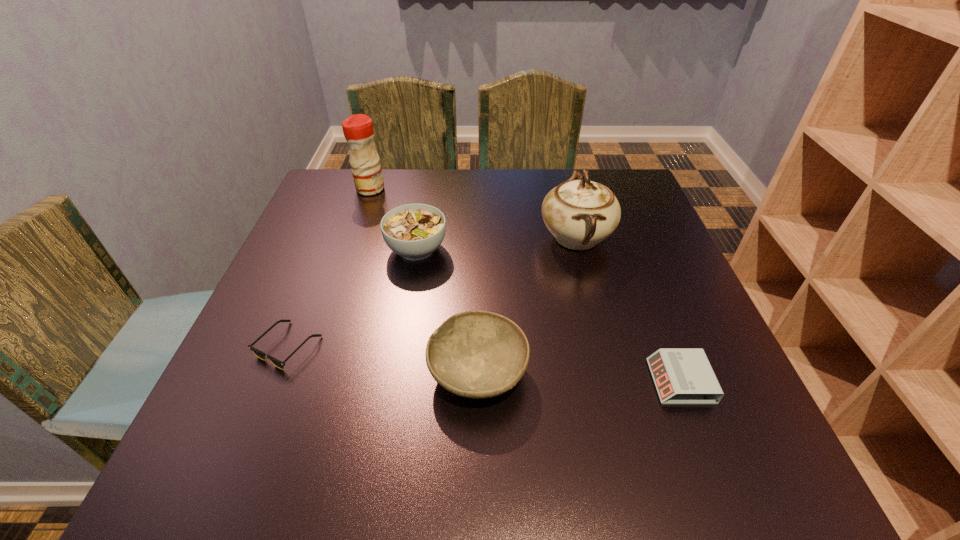
Find the location of `free location located on the back of the fifth tallest object`. free location located on the back of the fifth tallest object is located at coordinates (621, 230).

Locate an element on the screen. Image resolution: width=960 pixels, height=540 pixels. free space located on the lenses of the shortest object is located at coordinates (267, 398).

At what (x,y) coordinates should I click in order to perform the action: click on condiment present at the far edge. Please return your answer as a coordinate pair (x, y). Looking at the image, I should click on (358, 130).

Where is `chinaware positioned at the far edge`? The height and width of the screenshot is (540, 960). chinaware positioned at the far edge is located at coordinates (581, 213).

You are a GUI agent. You are given a task and a screenshot of the screen. Output one action in this format:
    pyautogui.click(x=<x>, y=<y>)
    Task: Click on the condiment that is positioned at the left edge
    Image resolution: width=960 pixels, height=540 pixels.
    Given the screenshot: What is the action you would take?
    pyautogui.click(x=358, y=130)

Identify the location of sunglasses that is at the left edge. This screenshot has height=540, width=960. (258, 353).

At what (x,y) coordinates should I click in order to perform the action: click on chinaware that is at the right edge. Please return your answer as a coordinate pair (x, y). This screenshot has width=960, height=540. Looking at the image, I should click on coord(581,213).

Locate an element on the screen. alarm clock situated at the right edge is located at coordinates point(682,376).

Locate an element on the screen. The image size is (960, 540). object located at the far left corner is located at coordinates (358, 130).

Locate an element on the screen. object positioned at the far right corner is located at coordinates (581, 213).